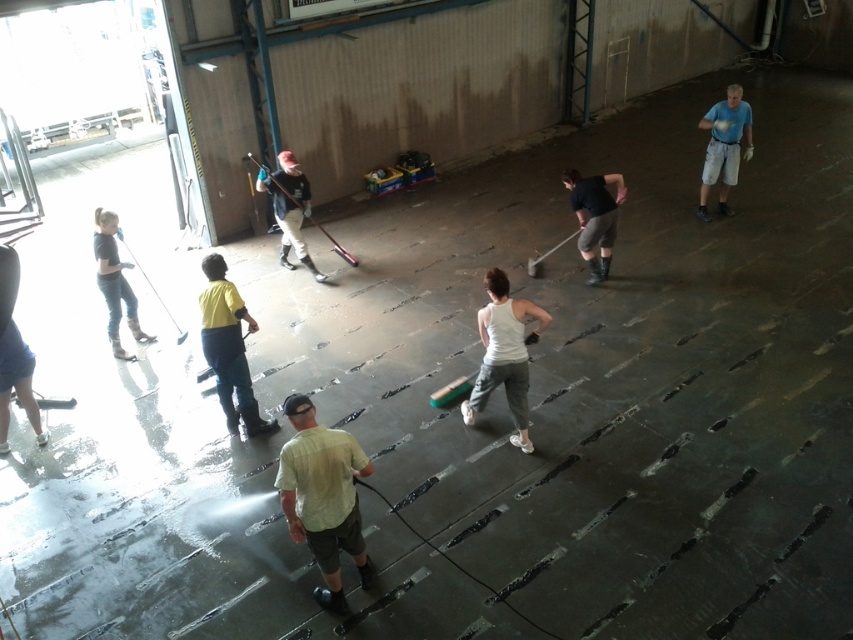
You are standing in the industrial space and see a point marked at coordinates (323, 497). According to the image, what object or part of an object is located at that point?

The point at coordinates (323, 497) is located on the light green fabric shirt at center.

You are standing at the origin point of the coordinate system with the image center as the origin. You need to move towards the denim jeans at left. In which direction should you move first? Please answer with a single word from the options below. Options are left, right, forward, backward, up, down.

The denim jeans at left is located at coordinate point (114, 282). Since the origin is the image center, the positive x direction is to the right and positive y direction is downward. The x coordinate of 0.442 is positive, meaning it is to the right of the center. The y coordinate of 0.135 is also positive, so it is below the center. To reach the denim jeans at left, you should first move forward towards the lower part of the image. However, the question mentions moving towards the denim jeans at left. If